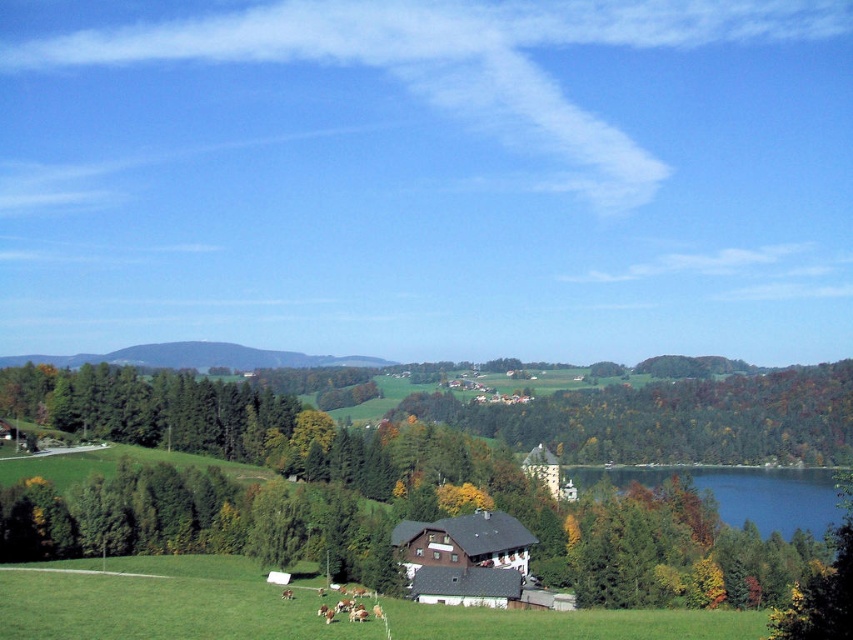
You are an artist planning to paint this rural landscape. You want to ensure the green matte tree at center and the green grassy hillside at center are proportionally accurate. Which of these two objects should you paint to be narrower in your artwork?

The green matte tree at center should be painted narrower because it has a lesser width compared to the green grassy hillside at center.

You are an observer standing in the field looking towards the mountains. You notice both the green matte tree at center and the green grassy hillside at center. Which one is closer to you?

The green matte tree at center is closer to you because it is positioned in front of the green grassy hillside at center.

You are standing in the middle of the field and want to take a photo of the green matte tree at center and the green grassy hillside at center. Which object will appear larger in your camera viewfinder?

The green matte tree at center will appear larger in the camera viewfinder because it is taller than the green grassy hillside at center.